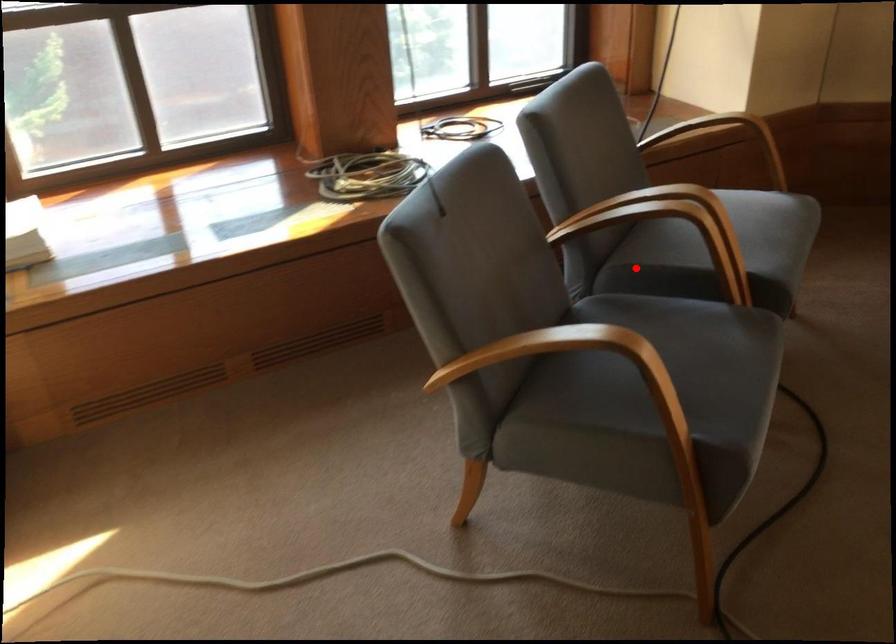
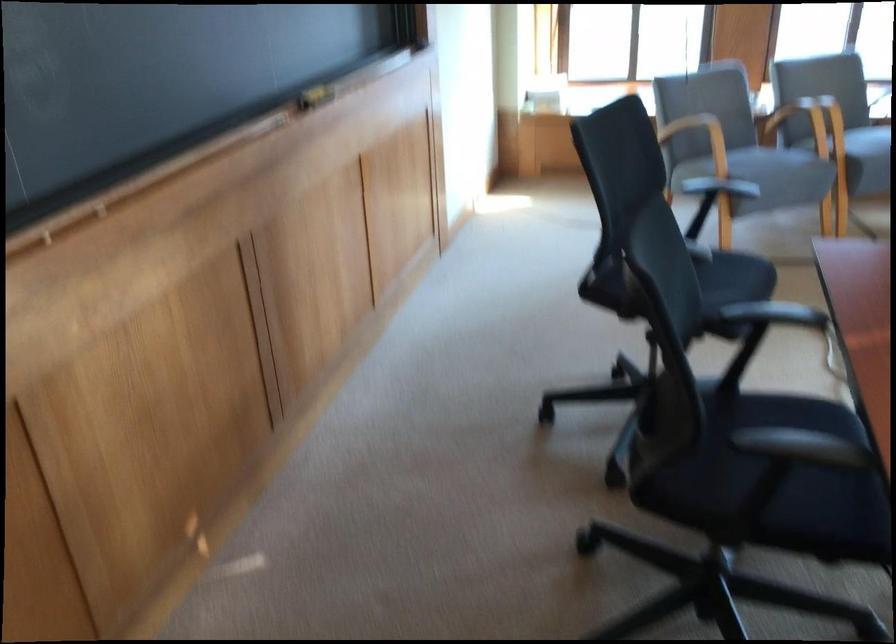
The point at the highlighted location is marked in the first image. Where is the corresponding point in the second image?

(799, 122)